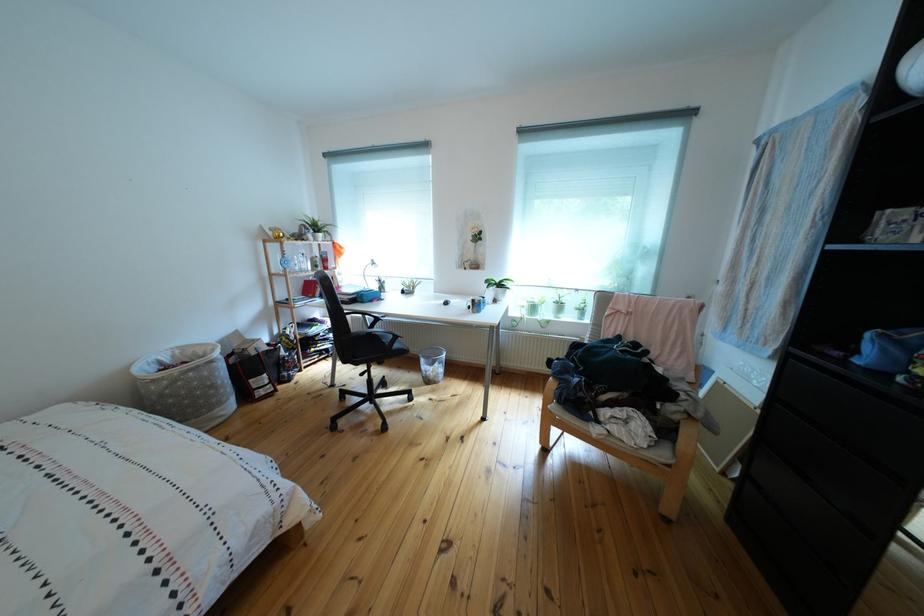
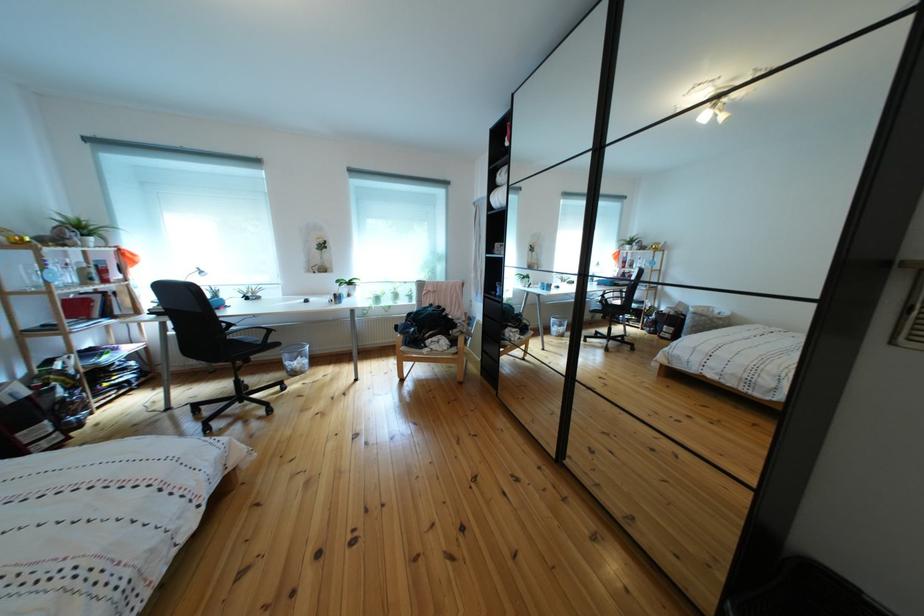
Where in the second image is the point corresponding to the point at 412,285 from the first image?

(247, 293)